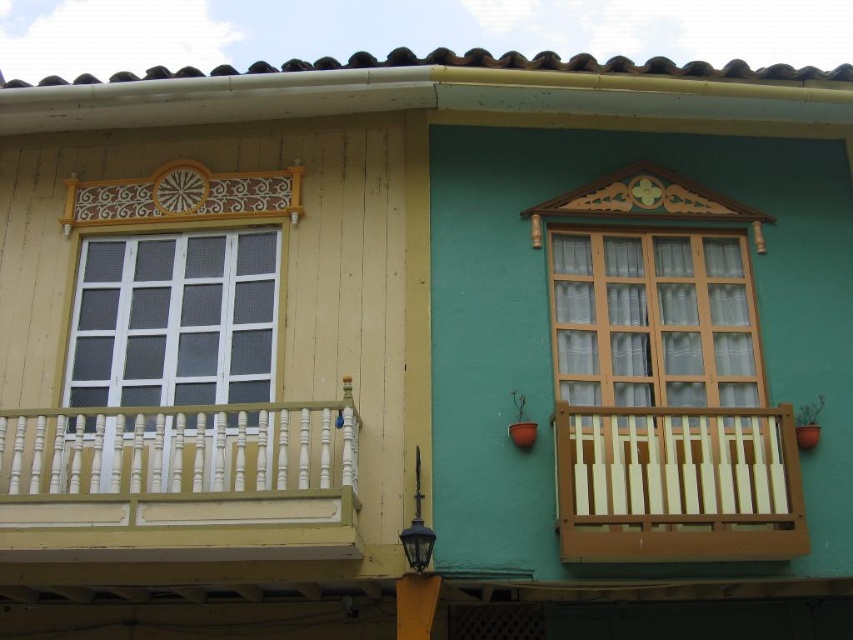
Question: Can you confirm if translucent glass window at center is wider than white wooden window at left?

Choices:
 (A) no
 (B) yes

Answer: (A)

Question: Does white painted wood balcony at left come in front of wooden at right?

Choices:
 (A) no
 (B) yes

Answer: (B)

Question: Can you confirm if white painted wood balcony at left is bigger than translucent glass window at center?

Choices:
 (A) no
 (B) yes

Answer: (B)

Question: Estimate the real-world distances between objects in this image. Which object is closer to the white wooden window at left?

Choices:
 (A) white painted wood balcony at left
 (B) translucent glass window at center
 (C) wooden at right

Answer: (A)

Question: Which of these objects is positioned farthest from the white wooden window at left?

Choices:
 (A) translucent glass window at center
 (B) wooden at right

Answer: (B)

Question: Considering the real-world distances, which object is farthest from the white wooden window at left?

Choices:
 (A) white painted wood balcony at left
 (B) wooden at right
 (C) translucent glass window at center

Answer: (B)